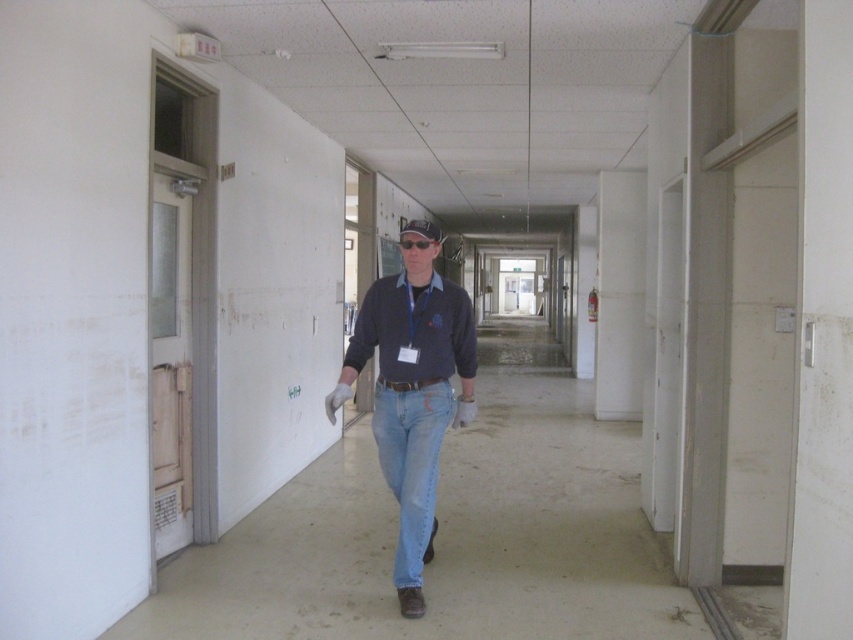
Question: Is blue denim jeans at center positioned in front of light blue denim jeans at center?

Choices:
 (A) no
 (B) yes

Answer: (B)

Question: Based on their relative distances, which object is nearer to the dark blue sweater at center?

Choices:
 (A) light blue denim jeans at center
 (B) blue denim jeans at center

Answer: (B)

Question: Which of the following is the farthest from the observer?

Choices:
 (A) dark blue sweater at center
 (B) light blue denim jeans at center
 (C) blue denim jeans at center

Answer: (A)

Question: Does blue denim jeans at center have a larger size compared to dark blue sweater at center?

Choices:
 (A) no
 (B) yes

Answer: (B)

Question: Does blue denim jeans at center come behind dark blue sweater at center?

Choices:
 (A) yes
 (B) no

Answer: (B)

Question: Which point is farther from the camera taking this photo?

Choices:
 (A) (430, 531)
 (B) (401, 612)

Answer: (A)